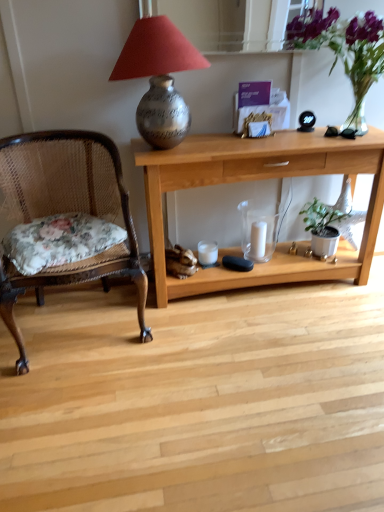
This screenshot has width=384, height=512. I want to click on empty space that is in between woven wood chair with floral cushion at left and light wood desk at center, so click(229, 317).